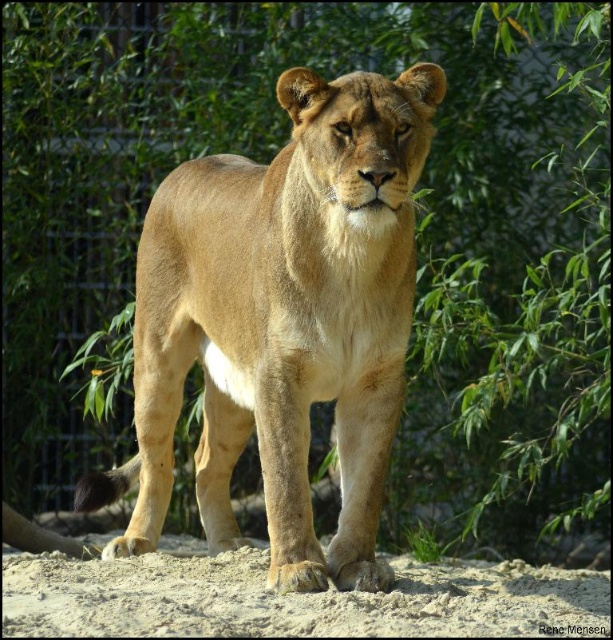
You are a zookeeper planning to place a new feeding station in the enclosure. The golden fur lion at center is currently at coordinates 0.503 on the x axis and 0.460 on the y axis. If the feeding station must be placed at least 2 meters away from the lion to ensure safety, what is the minimum distance in meters between the lion and the feeding station?

The golden fur lion at center is at coordinates 0.503 on the x axis and 0.460 on the y axis. To ensure safety, the feeding station must be placed at least 2 meters away from the lion. Therefore, the minimum distance between the golden fur lion at center and the feeding station should be 2 meters.

You are a zookeeper observing the lioness in its enclosure. You need to determine if the golden fur lion at center can lie down on the light brown sandy ground at lower center without exceeding its width. Can it fit?

The golden fur lion at center is thinner than the light brown sandy ground at lower center, so it can fit comfortably on the ground without exceeding its width.